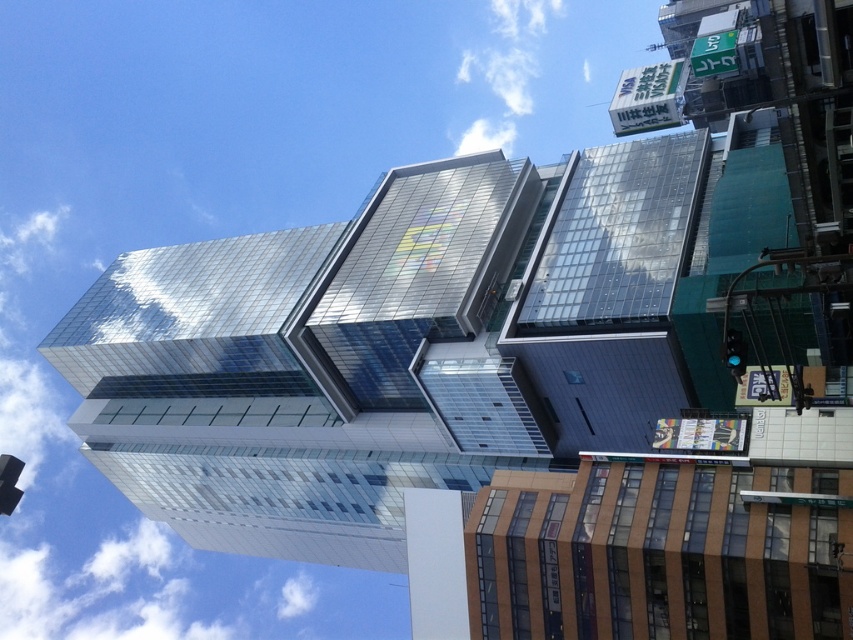
Question: Does black glass traffic light at lower left appear over green glass traffic light at right?

Choices:
 (A) no
 (B) yes

Answer: (A)

Question: Can you confirm if black glass traffic light at lower left is thinner than green glass traffic light at right?

Choices:
 (A) no
 (B) yes

Answer: (A)

Question: Is black glass traffic light at lower left smaller than green glass traffic light at right?

Choices:
 (A) no
 (B) yes

Answer: (A)

Question: Which of the following is the closest to the observer?

Choices:
 (A) tap(732, 352)
 (B) tap(9, 465)

Answer: (A)